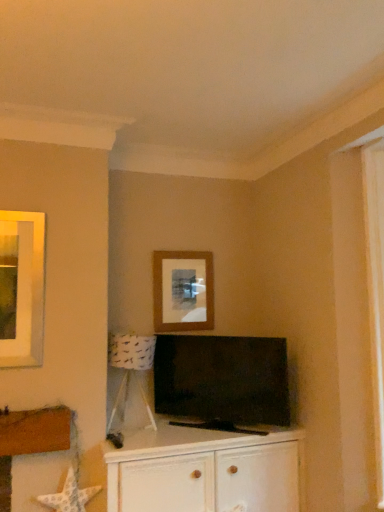
Question: Should I look upward or downward to see white wood cabinet at center?

Choices:
 (A) down
 (B) up

Answer: (A)

Question: Considering the relative sizes of matte brown picture frame at center and matte black tv at center in the image provided, is matte brown picture frame at center taller than matte black tv at center?

Choices:
 (A) no
 (B) yes

Answer: (A)

Question: Considering the relative positions of matte brown picture frame at center and matte black tv at center in the image provided, is matte brown picture frame at center to the right of matte black tv at center from the viewer's perspective?

Choices:
 (A) yes
 (B) no

Answer: (B)

Question: Is matte brown picture frame at center oriented towards matte black tv at center?

Choices:
 (A) no
 (B) yes

Answer: (A)

Question: From the image's perspective, does matte brown picture frame at center appear lower than matte black tv at center?

Choices:
 (A) no
 (B) yes

Answer: (A)

Question: Does matte brown picture frame at center have a larger size compared to matte black tv at center?

Choices:
 (A) no
 (B) yes

Answer: (A)

Question: Is matte brown picture frame at center facing away from matte black tv at center?

Choices:
 (A) yes
 (B) no

Answer: (B)

Question: Can we say white wood cabinet at center lies outside matte brown picture frame at center?

Choices:
 (A) no
 (B) yes

Answer: (B)

Question: Can you confirm if white wood cabinet at center is bigger than matte brown picture frame at center?

Choices:
 (A) yes
 (B) no

Answer: (A)

Question: From the image's perspective, is white wood cabinet at center located above matte brown picture frame at center?

Choices:
 (A) yes
 (B) no

Answer: (B)

Question: Does white wood cabinet at center turn towards matte brown picture frame at center?

Choices:
 (A) yes
 (B) no

Answer: (B)

Question: Does white wood cabinet at center lie in front of matte brown picture frame at center?

Choices:
 (A) no
 (B) yes

Answer: (B)

Question: Considering the relative sizes of white wood cabinet at center and matte brown picture frame at center in the image provided, is white wood cabinet at center wider than matte brown picture frame at center?

Choices:
 (A) no
 (B) yes

Answer: (B)

Question: Does matte brown picture frame at center turn towards white paper lampshade at lower left?

Choices:
 (A) no
 (B) yes

Answer: (A)